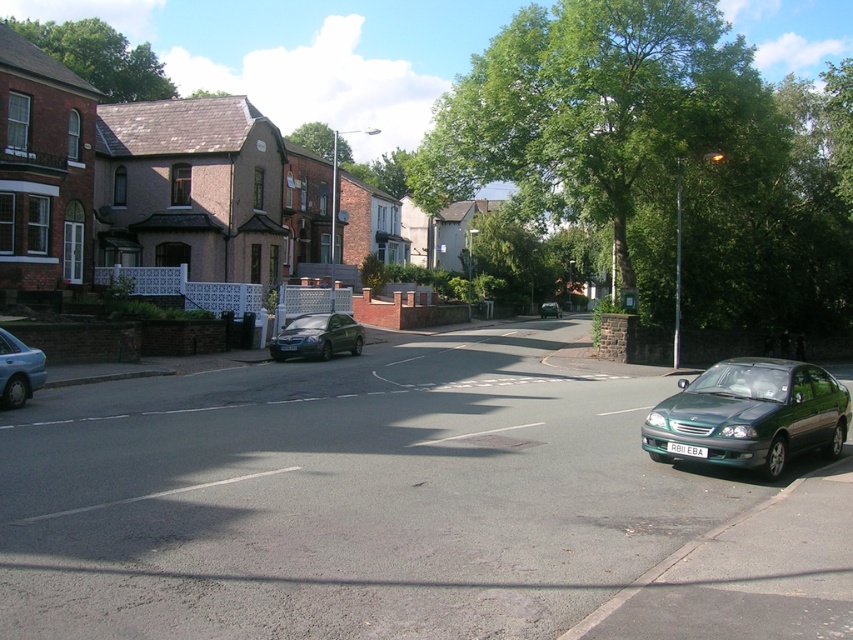
In the scene shown: Can you confirm if green leafy tree at upper center is taller than shiny silver sedan at center?

Indeed, green leafy tree at upper center has a greater height compared to shiny silver sedan at center.

Which is in front, point (653, 140) or point (277, 358)?

Point (277, 358) is more forward.

Where is `green leafy tree at upper center`? green leafy tree at upper center is located at coordinates (596, 113).

Who is positioned more to the right, green metallic car at lower right or metallic silver sedan at center?

From the viewer's perspective, metallic silver sedan at center appears more on the right side.

Is green metallic car at lower right shorter than metallic silver sedan at center?

Yes.

Locate an element on the screen. The height and width of the screenshot is (640, 853). green metallic car at lower right is located at coordinates (750, 416).

Who is positioned more to the right, green metallic car at lower right or green leafy tree at upper left?

From the viewer's perspective, green metallic car at lower right appears more on the right side.

Can you confirm if green metallic car at lower right is positioned above green leafy tree at upper left?

Actually, green metallic car at lower right is below green leafy tree at upper left.

Between point (721, 369) and point (6, 22), which one is positioned behind?

Positioned behind is point (6, 22).

Identify the location of green metallic car at lower right. The width and height of the screenshot is (853, 640). (750, 416).